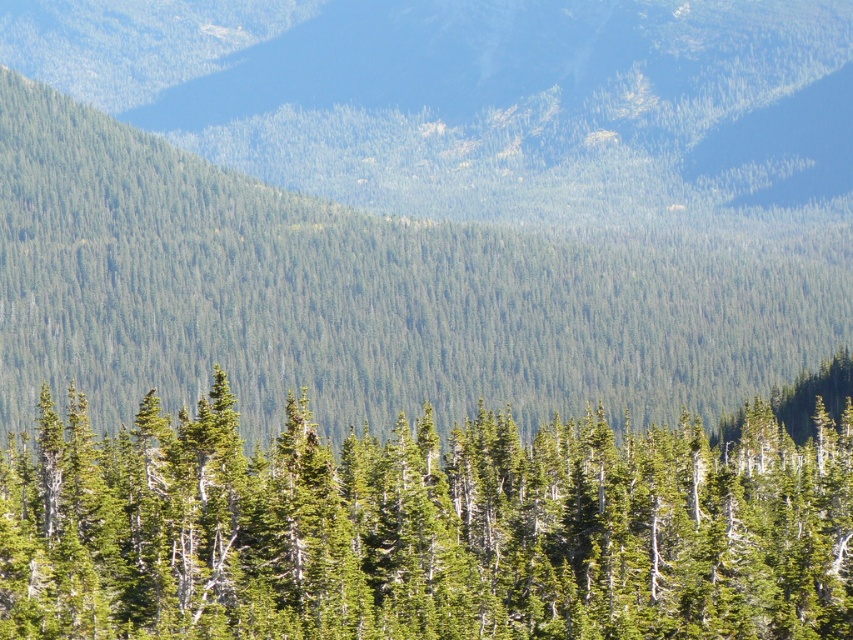
Consider the image. You are standing in the forest looking at the mountain. You notice two points marked on the image. One is at coordinates point (10, 218) and the other is at point (566, 541). Which point is closer to you?

Point (10, 218) is closer to you because it is further to the viewer than point (566, 541).

You are a hiker planning to take a photo of the green forested mountain at center and the green matte tree at center. Which object should you focus on first to ensure both are in the frame?

You should focus on the green forested mountain at center first because it is closer to you than the green matte tree at center, so adjusting the camera to include it will also capture the tree in the background.